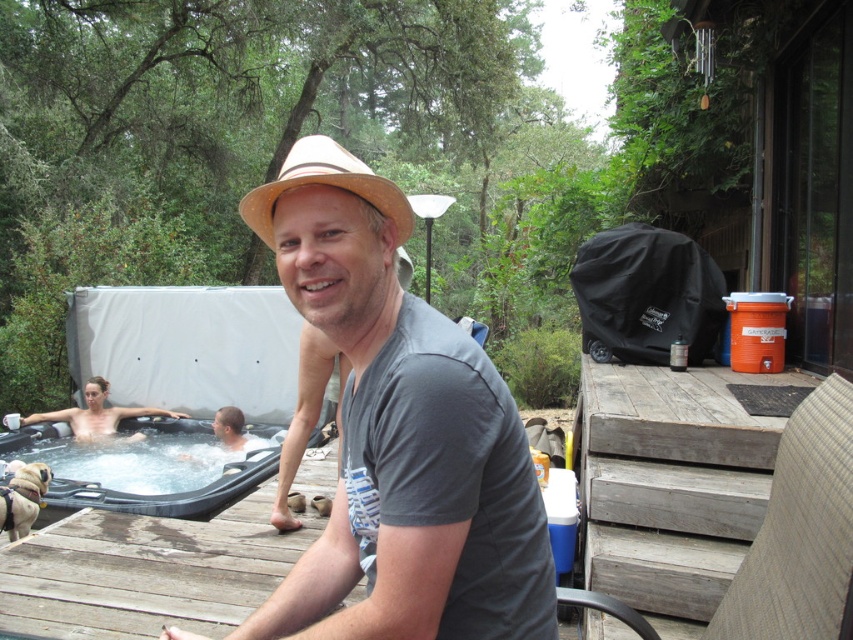
Does point (227, 632) come behind point (294, 182)?

Yes.

Can you confirm if wooden at center is positioned above straw hat at center?

Actually, wooden at center is below straw hat at center.

Image resolution: width=853 pixels, height=640 pixels. I want to click on wooden at center, so click(x=146, y=572).

I want to click on wooden at center, so click(146, 572).

Which is more to the right, tan straw hat at center or smooth skin woman at lower left?

Positioned to the right is tan straw hat at center.

Is point (480, 614) less distant than point (103, 385)?

Yes, point (480, 614) is closer to viewer.

The width and height of the screenshot is (853, 640). Find the location of `tan straw hat at center`. tan straw hat at center is located at coordinates (399, 435).

Who is positioned more to the right, tan straw hat at center or wooden at center?

tan straw hat at center is more to the right.

Which is in front, point (308, 266) or point (238, 540)?

Point (308, 266) is in front.

Is point (337, 230) closer to camera compared to point (76, 595)?

Yes, point (337, 230) is closer to viewer.

This screenshot has height=640, width=853. Find the location of `tan straw hat at center`. tan straw hat at center is located at coordinates (399, 435).